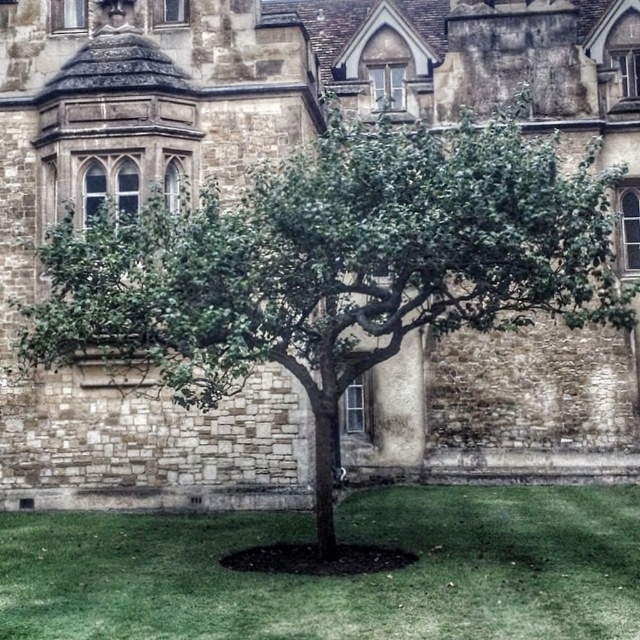
Question: Is green leafy tree at center wider than green grass at center?

Choices:
 (A) no
 (B) yes

Answer: (B)

Question: Which object appears farthest from the camera in this image?

Choices:
 (A) green leafy tree at center
 (B) green grass at center

Answer: (A)

Question: Can you confirm if green leafy tree at center is positioned above green grass at center?

Choices:
 (A) yes
 (B) no

Answer: (A)

Question: Observing the image, what is the correct spatial positioning of green leafy tree at center in reference to green grass at center?

Choices:
 (A) right
 (B) left

Answer: (A)